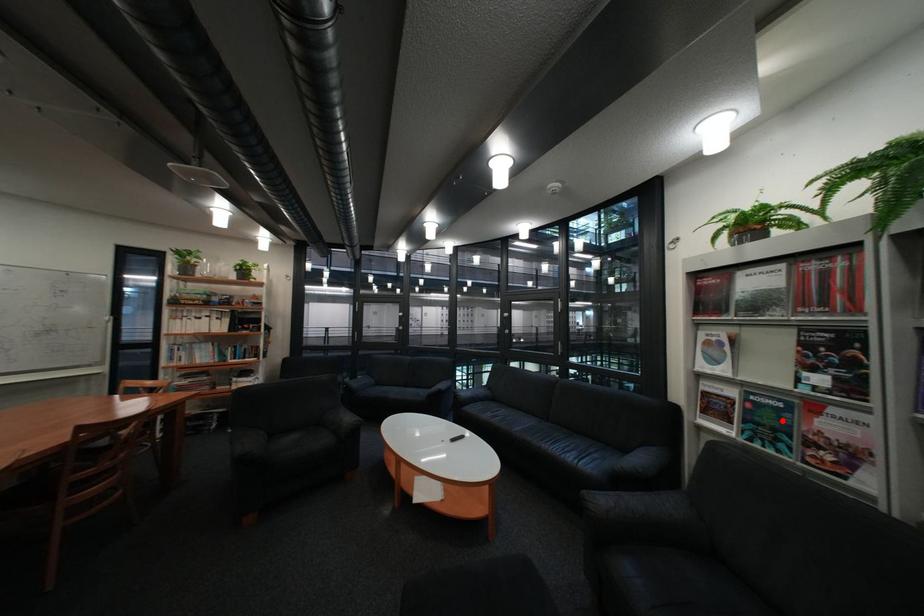
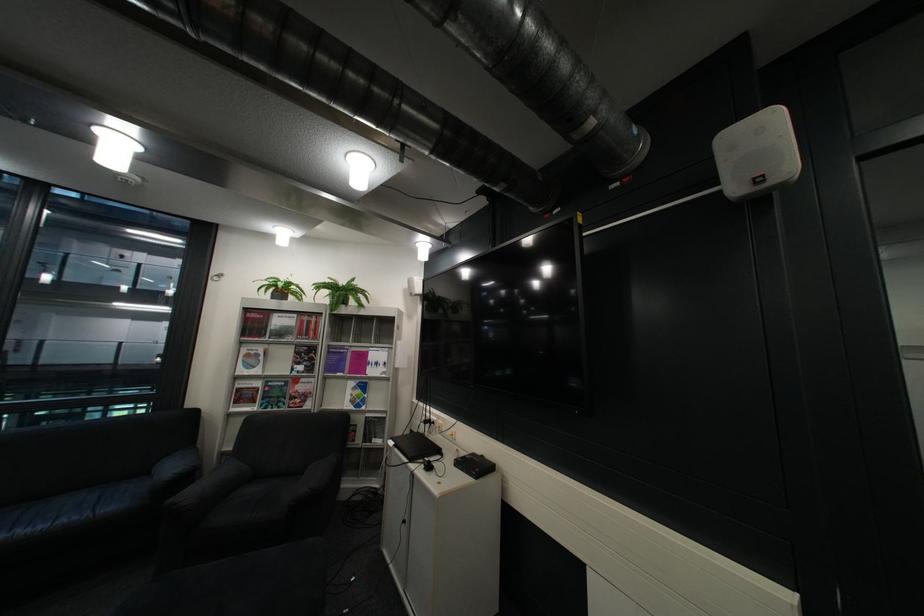
Locate, in the second image, the point that corresponds to the highlighted location in the first image.

(290, 394)